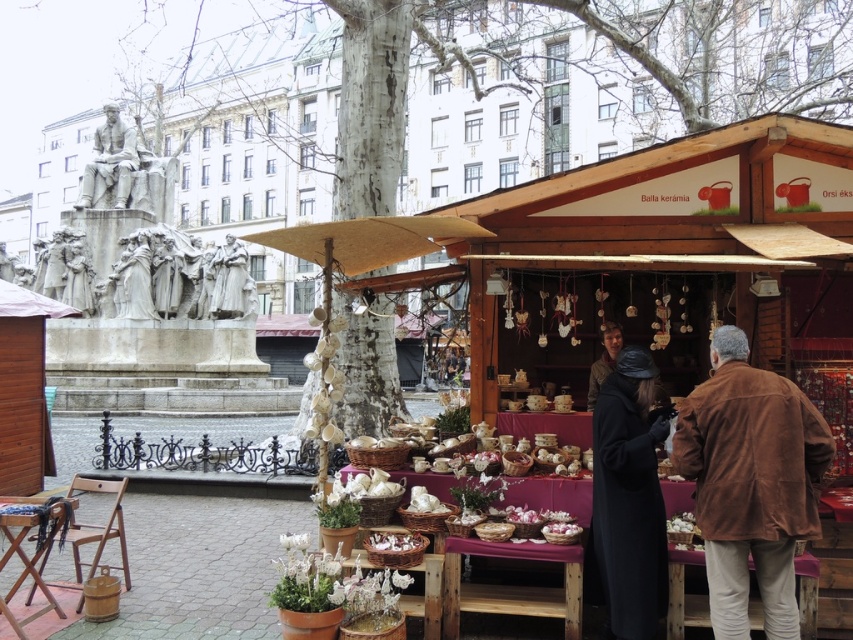
You are standing at the entrance of the market and want to buy a brown suede jacket at lower right. Based on the coordinates provided, in which direction should you walk to reach the jacket?

The brown suede jacket at lower right is located at coordinates point (750, 483). Since the coordinates are in the lower right of the image, you should walk towards the lower right direction to reach the jacket.

You are a customer at the market and want to try on both the brown suede jacket at lower right and the dark brown leather jacket at lower right. Which jacket should you reach for first if you want to pick them up in order from the one closest to you to the one farthest?

The brown suede jacket at lower right is located below the dark brown leather jacket at lower right, so the dark brown leather jacket at lower right is closer to you. You should reach for the dark brown leather jacket at lower right first, then the brown suede jacket at lower right.